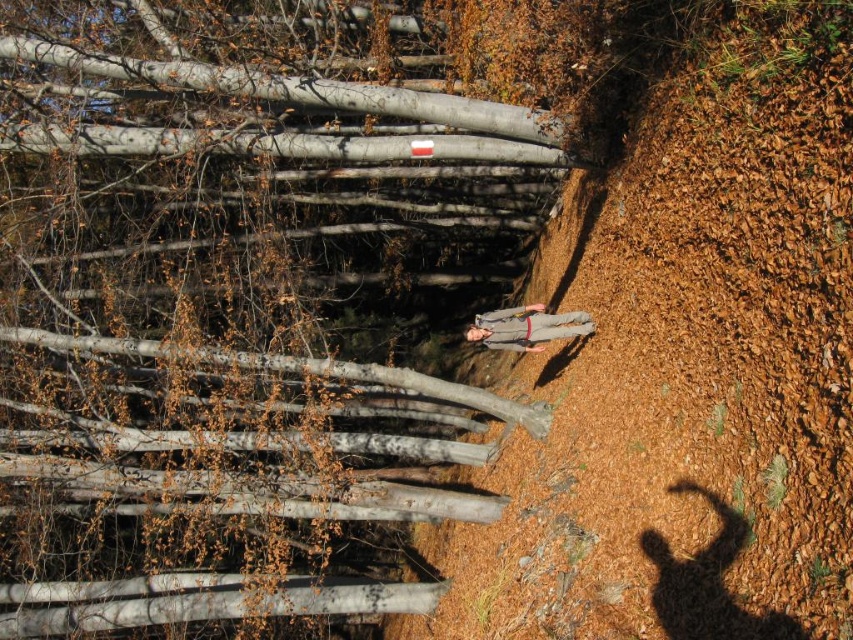
Does brown dirt track at center have a smaller size compared to gray fabric jacket at center?

No.

Is brown dirt track at center closer to the viewer compared to gray fabric jacket at center?

Yes, it is.

Is point (767, 58) positioned before point (492, 339)?

Yes, it is.

Find the location of a particular element. brown dirt track at center is located at coordinates (689, 364).

Can you confirm if smooth bark tree at center is wider than gray fabric jacket at center?

Correct, the width of smooth bark tree at center exceeds that of gray fabric jacket at center.

Is point (375, 440) less distant than point (519, 323)?

No, (375, 440) is behind (519, 323).

Between point (520, 196) and point (483, 316), which one is positioned in front?

Point (483, 316) is in front.

You are a GUI agent. You are given a task and a screenshot of the screen. Output one action in this format:
    pyautogui.click(x=<x>, y=<y>)
    Task: Click on the smooth bark tree at center
    
    Given the screenshot: What is the action you would take?
    pyautogui.click(x=238, y=296)

Who is positioned more to the right, smooth bark tree at center or brown dirt track at center?

Positioned to the right is brown dirt track at center.

Where is `smooth bark tree at center`? smooth bark tree at center is located at coordinates (238, 296).